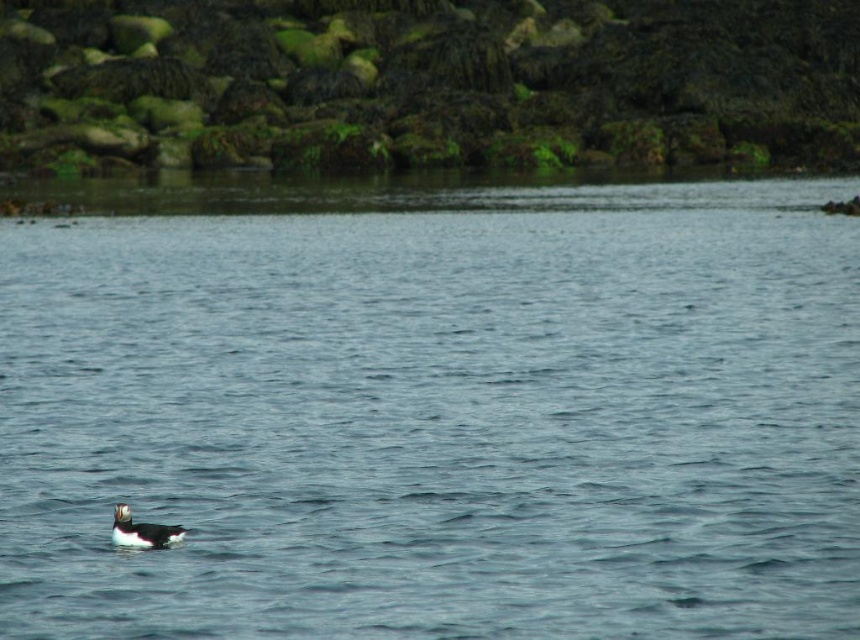
Is blue water at center to the right of white fluffy duck at lower left from the viewer's perspective?

Indeed, blue water at center is positioned on the right side of white fluffy duck at lower left.

Is blue water at center wider than white fluffy duck at lower left?

Yes.

Identify the location of blue water at center. The image size is (860, 640). (431, 406).